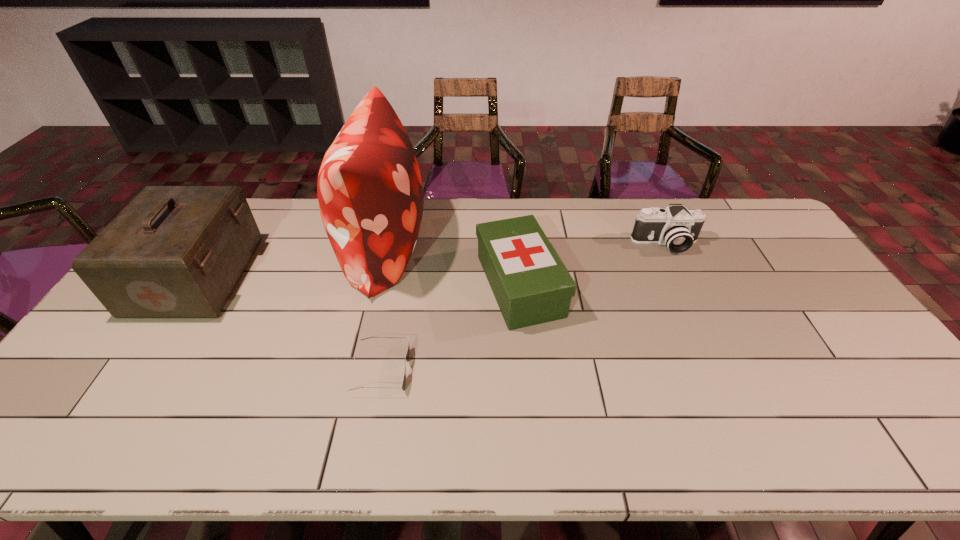
This screenshot has width=960, height=540. I want to click on the tallest object, so click(x=370, y=193).

The width and height of the screenshot is (960, 540). What are the coordinates of `the leftmost object` in the screenshot? It's located at click(x=174, y=251).

What are the coordinates of `the taller first-aid kit` in the screenshot? It's located at (174, 251).

This screenshot has height=540, width=960. I want to click on the rightmost object, so 678,228.

Locate an element on the screen. The width and height of the screenshot is (960, 540). the second object from right to left is located at coordinates (531, 285).

The image size is (960, 540). Find the location of `the right first-aid kit`. the right first-aid kit is located at coordinates (531, 285).

Image resolution: width=960 pixels, height=540 pixels. I want to click on the nearest object, so click(x=407, y=357).

This screenshot has height=540, width=960. I want to click on sunglasses, so click(407, 357).

Image resolution: width=960 pixels, height=540 pixels. Identify the location of vacant space situated on the front-facing side of the cushion. (493, 248).

Where is `free space located on the right of the left first-aid kit`? free space located on the right of the left first-aid kit is located at coordinates (277, 277).